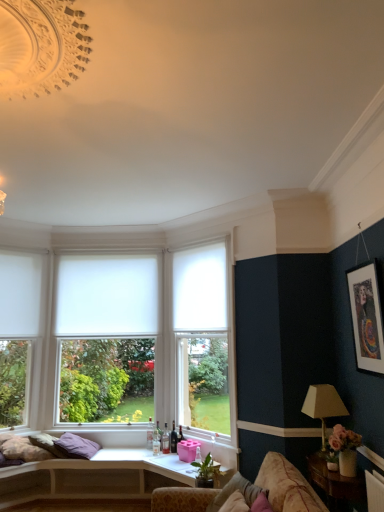
This screenshot has height=512, width=384. In order to click on white matte window at center, arranged as the 1th window when viewed from the right in this screenshot , I will do `click(202, 337)`.

Looking at this image, what is the approximate width of white matte window at center, arranged as the 1th window when viewed from the right?

white matte window at center, arranged as the 1th window when viewed from the right, is 7.03 inches in width.

Image resolution: width=384 pixels, height=512 pixels. Find the location of `white matte curtain at left, the 2th curtain when ordered from right to left`. white matte curtain at left, the 2th curtain when ordered from right to left is located at coordinates (20, 294).

What do you see at coordinates (107, 295) in the screenshot?
I see `white matte blind at center` at bounding box center [107, 295].

Describe the element at coordinates (76, 446) in the screenshot. I see `purple fabric pillow at lower left, marked as the first pillow in a left-to-right arrangement` at that location.

This screenshot has width=384, height=512. What do you see at coordinates (366, 317) in the screenshot?
I see `matte black picture frame at upper right` at bounding box center [366, 317].

Where is `white matte window at center, arranged as the 1th window when viewed from the right`? The image size is (384, 512). white matte window at center, arranged as the 1th window when viewed from the right is located at coordinates (202, 337).

Is white matte curtain at center, marked as the second curtain in a left-to-right arrangement, smaller than white fabric lampshade at right?

Actually, white matte curtain at center, marked as the second curtain in a left-to-right arrangement, might be larger than white fabric lampshade at right.

Where is `the 1st curtain to the left when counting from the white fabric lampshade at right`? the 1st curtain to the left when counting from the white fabric lampshade at right is located at coordinates (200, 289).

Considering the sizes of white matte curtain at center, arranged as the first curtain when viewed from the right, and white fabric lampshade at right in the image, is white matte curtain at center, arranged as the first curtain when viewed from the right, wider or thinner than white fabric lampshade at right?

white matte curtain at center, arranged as the first curtain when viewed from the right, is thinner than white fabric lampshade at right.

Would you consider white matte curtain at center, marked as the second curtain in a left-to-right arrangement, to be distant from white fabric lampshade at right?

Yes, white matte curtain at center, marked as the second curtain in a left-to-right arrangement, and white fabric lampshade at right are located far from each other.

Is white matte blind at center to the right of pink fabric pillow at lower right, arranged as the first pillow when viewed from the right, from the viewer's perspective?

Incorrect, white matte blind at center is not on the right side of pink fabric pillow at lower right, arranged as the first pillow when viewed from the right.

Considering the sizes of white matte blind at center and pink fabric pillow at lower right, which is the 2th pillow from bottom to top, in the image, is white matte blind at center wider or thinner than pink fabric pillow at lower right, which is the 2th pillow from bottom to top,?

white matte blind at center is thinner than pink fabric pillow at lower right, which is the 2th pillow from bottom to top.

Is white matte blind at center oriented towards pink fabric pillow at lower right, which is counted as the second pillow, starting from the back?

Yes, white matte blind at center is oriented towards pink fabric pillow at lower right, which is counted as the second pillow, starting from the back.

From the picture: Is white matte blind at center next to pink fabric pillow at lower right, placed as the 1th pillow when sorted from top to bottom, and touching it?

white matte blind at center and pink fabric pillow at lower right, placed as the 1th pillow when sorted from top to bottom, are not in contact.

Considering their positions, is matte black picture frame at upper right located in front of or behind white matte curtain at left, the 2th curtain when ordered from right to left?

Clearly, matte black picture frame at upper right is in front of white matte curtain at left, the 2th curtain when ordered from right to left.

Considering the relative sizes of matte black picture frame at upper right and white matte curtain at left, the 2th curtain when ordered from right to left, in the image provided, is matte black picture frame at upper right smaller than white matte curtain at left, the 2th curtain when ordered from right to left,?

Actually, matte black picture frame at upper right might be larger than white matte curtain at left, the 2th curtain when ordered from right to left.

Find the location of `the 2nd curtain behind the matte black picture frame at upper right`. the 2nd curtain behind the matte black picture frame at upper right is located at coordinates (20, 294).

Between matte black picture frame at upper right and white matte curtain at left, the 2th curtain when ordered from right to left, which one has less height?

Standing shorter between the two is white matte curtain at left, the 2th curtain when ordered from right to left.

Considering the positions of objects white matte window at left, the first window from the left, and white matte window at center, the 2th window when ordered from right to left, in the image provided, who is more to the left, white matte window at left, the first window from the left, or white matte window at center, the 2th window when ordered from right to left,?

From the viewer's perspective, white matte window at left, the first window from the left, appears more on the left side.

Which object is further away from the camera taking this photo, white matte window at left, the first window from the left, or white matte window at center, the 2th window when ordered from right to left?

white matte window at center, the 2th window when ordered from right to left.

Is white matte window at left, the first window from the left, inside or outside of white matte window at center, positioned as the 2th window in left-to-right order?

white matte window at left, the first window from the left, is not inside white matte window at center, positioned as the 2th window in left-to-right order, it's outside.

From the picture: From the image's perspective, is white matte window at left, marked as the 3th window in a right-to-left arrangement, located beneath white matte window at center, positioned as the 2th window in left-to-right order?

No, from the image's perspective, white matte window at left, marked as the 3th window in a right-to-left arrangement, is not beneath white matte window at center, positioned as the 2th window in left-to-right order.

Is point (240, 492) positioned in front of point (346, 488)?

Yes, it is.

Between pink fabric pillow at lower right, which is counted as the second pillow, starting from the back, and wooden side table at lower right, which one is positioned in front?

Positioned in front is pink fabric pillow at lower right, which is counted as the second pillow, starting from the back.

In the scene shown: Is pink fabric pillow at lower right, the first pillow when ordered from front to back, wider than wooden side table at lower right?

No.

Is pink fabric pillow at lower right, the first pillow when ordered from front to back, outside of wooden side table at lower right?

Absolutely, pink fabric pillow at lower right, the first pillow when ordered from front to back, is external to wooden side table at lower right.

How much distance is there between wooden at lower left and pink fabric pillow at lower right, which is the second pillow from left to right?

They are 4.70 feet apart.

Is wooden at lower left beside pink fabric pillow at lower right, which is the 2th pillow from bottom to top?

wooden at lower left and pink fabric pillow at lower right, which is the 2th pillow from bottom to top, are not in contact.

Does wooden at lower left appear on the right side of pink fabric pillow at lower right, which is the second pillow from left to right?

No.

From a real-world perspective, relative to pink fabric pillow at lower right, which is the 2th pillow from bottom to top, is wooden at lower left vertically above or below?

From a real-world perspective, wooden at lower left is physically below pink fabric pillow at lower right, which is the 2th pillow from bottom to top.

From the image's perspective, between white matte curtain at center, arranged as the first curtain when viewed from the right, and white matte blind at center, which one is located above?

white matte curtain at center, arranged as the first curtain when viewed from the right, from the image's perspective.

Can you confirm if white matte curtain at center, arranged as the first curtain when viewed from the right, is thinner than white matte blind at center?

No.

At what (x,y) coordinates should I click in order to perform the action: click on blind located below the white matte curtain at center, arranged as the first curtain when viewed from the right (from the image's perspective). Please return your answer as a coordinate pair (x, y). Looking at the image, I should click on coord(107,295).

Is white matte curtain at center, marked as the second curtain in a left-to-right arrangement, oriented towards white matte blind at center?

No, white matte curtain at center, marked as the second curtain in a left-to-right arrangement, is not turned towards white matte blind at center.

The width and height of the screenshot is (384, 512). I want to click on the 1st curtain to the left of the white fabric lampshade at right, counting from the anchor's position, so click(x=200, y=289).

The image size is (384, 512). In order to click on blind that appears behind the pink fabric pillow at lower right, which is the 2th pillow from bottom to top in this screenshot , I will do `click(107, 295)`.

When comparing their distances from pink fabric pillow at lower right, the first pillow when ordered from front to back, does white matte blind at center or matte black picture frame at upper right seem further?

white matte blind at center is positioned further to the anchor pink fabric pillow at lower right, the first pillow when ordered from front to back.

Looking at the image, which one is located closer to wooden side table at lower right, white matte curtain at left, the 2th curtain when ordered from right to left, or white matte window at center, positioned as the 2th window in left-to-right order?

white matte window at center, positioned as the 2th window in left-to-right order, is positioned closer to the anchor wooden side table at lower right.

From the image, which object appears to be nearer to purple fabric pillow at lower left, placed as the second pillow when sorted from right to left, matte black picture frame at upper right or wooden at lower left?

Among the two, wooden at lower left is located nearer to purple fabric pillow at lower left, placed as the second pillow when sorted from right to left.

When comparing their distances from white matte window at left, marked as the 3th window in a right-to-left arrangement, does white fabric lampshade at right or purple fabric pillow at lower left, placed as the second pillow when sorted from right to left, seem further?

white fabric lampshade at right lies further to white matte window at left, marked as the 3th window in a right-to-left arrangement, than the other object.

When comparing their distances from wooden side table at lower right, does white matte window at left, marked as the 3th window in a right-to-left arrangement, or white matte blind at center seem further?

white matte window at left, marked as the 3th window in a right-to-left arrangement, is positioned further to the anchor wooden side table at lower right.

Looking at the image, which one is located further to white fabric lampshade at right, white matte window at center, positioned as the 2th window in left-to-right order, or purple fabric pillow at lower left, placed as the second pillow when sorted from right to left?

white matte window at center, positioned as the 2th window in left-to-right order.

Considering their positions, is white matte window at left, marked as the 3th window in a right-to-left arrangement, positioned closer to wooden side table at lower right than white matte window at center, the 2th window when ordered from right to left?

Among the two, white matte window at center, the 2th window when ordered from right to left, is located nearer to wooden side table at lower right.

From the image, which object appears to be nearer to white matte curtain at center, arranged as the first curtain when viewed from the right, white matte blind at center or pink fabric pillow at lower right, which is the second pillow from left to right?

Among the two, white matte blind at center is located nearer to white matte curtain at center, arranged as the first curtain when viewed from the right.

Locate an element on the screen. The width and height of the screenshot is (384, 512). pillow located between purple fabric pillow at lower left, marked as the first pillow in a left-to-right arrangement, and white fabric lampshade at right in the left-right direction is located at coordinates (235, 490).

Identify the location of lamp between pink fabric pillow at lower right, which is counted as the second pillow, starting from the back, and white matte blind at center in the front-back direction. (323, 405).

At what (x,y) coordinates should I click in order to perform the action: click on curtain between pink fabric pillow at lower right, which is the second pillow from left to right, and white matte window at left, the first window from the left, along the z-axis. Please return your answer as a coordinate pair (x, y). The height and width of the screenshot is (512, 384). Looking at the image, I should click on (200, 289).

Find the location of a particular element. The image size is (384, 512). blind between white matte curtain at center, marked as the second curtain in a left-to-right arrangement, and wooden at lower left in the up-down direction is located at coordinates (107, 295).